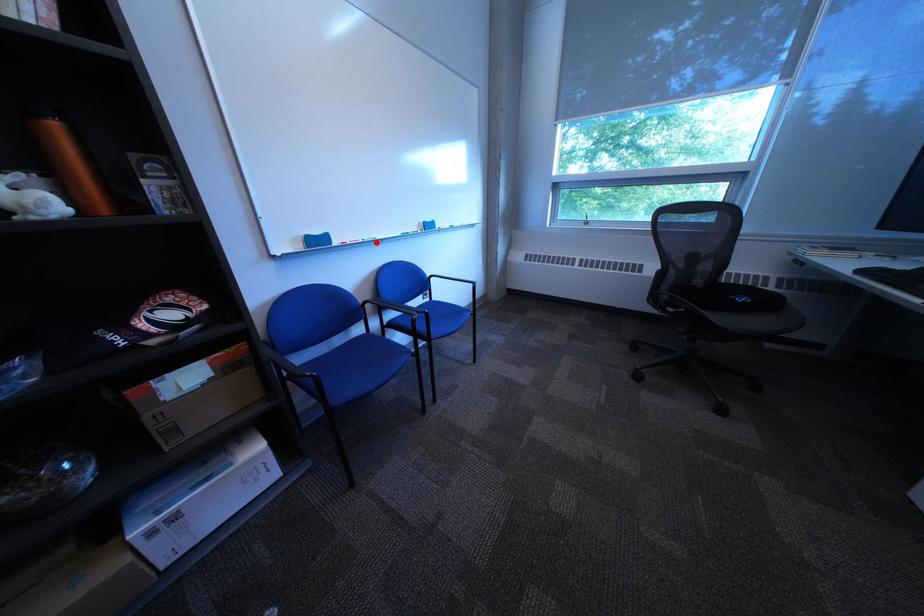
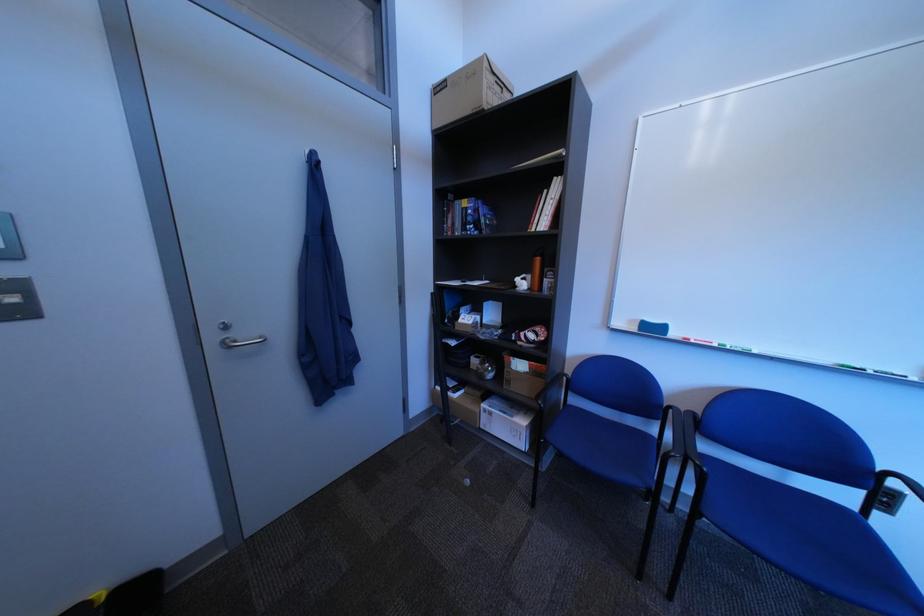
Locate, in the second image, the point that corresponds to the highlighted location in the first image.

(732, 347)